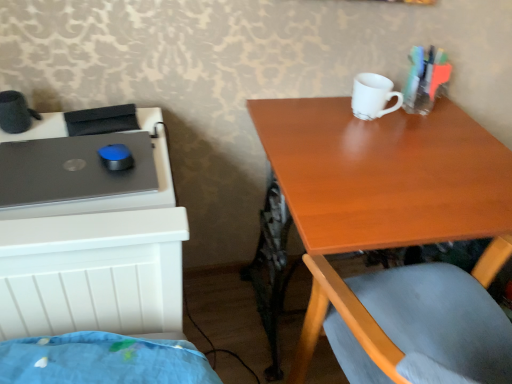
The width and height of the screenshot is (512, 384). In order to click on free space above matte black laptop at left (from a real-world perspective) in this screenshot , I will do `click(72, 164)`.